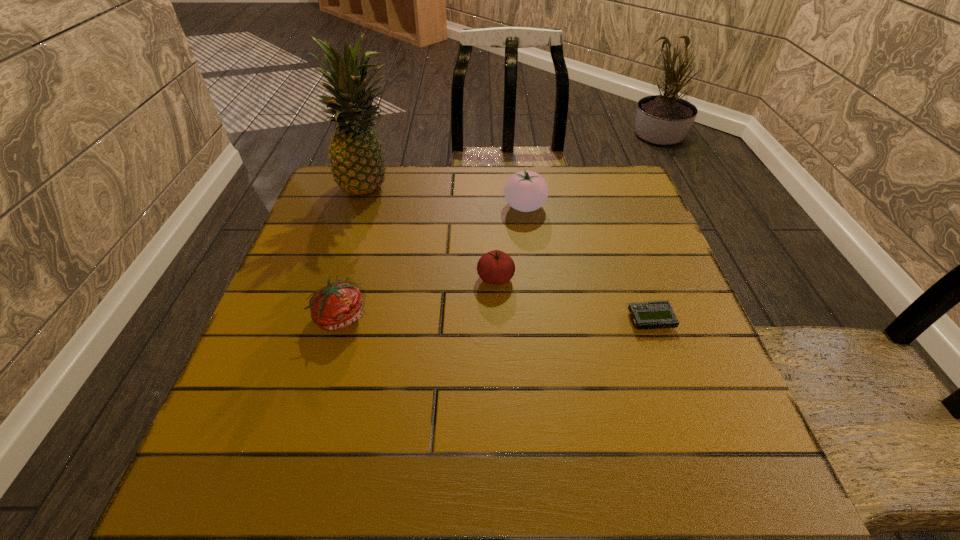
Find the location of `the tallest object`. the tallest object is located at coordinates (357, 164).

Where is `the fourth shortest object`? This screenshot has width=960, height=540. the fourth shortest object is located at coordinates (526, 191).

The height and width of the screenshot is (540, 960). I want to click on the farthest tomato, so click(x=526, y=191).

Identify the location of the leftmost tomato. (337, 306).

Locate an element on the screen. This screenshot has height=540, width=960. the second farthest tomato is located at coordinates (495, 267).

Locate an element on the screen. Image resolution: width=960 pixels, height=540 pixels. the rightmost object is located at coordinates (658, 314).

Locate an element on the screen. The width and height of the screenshot is (960, 540). beeper is located at coordinates (658, 314).

I want to click on vacant space situated 0.130m on the front of the pineapple, so click(x=355, y=235).

Find the location of a particular element. This screenshot has width=960, height=540. free region located 0.180m on the right of the second tallest object is located at coordinates (613, 206).

In order to click on vacant space located on the back of the leftmost tomato in this screenshot , I will do `click(361, 247)`.